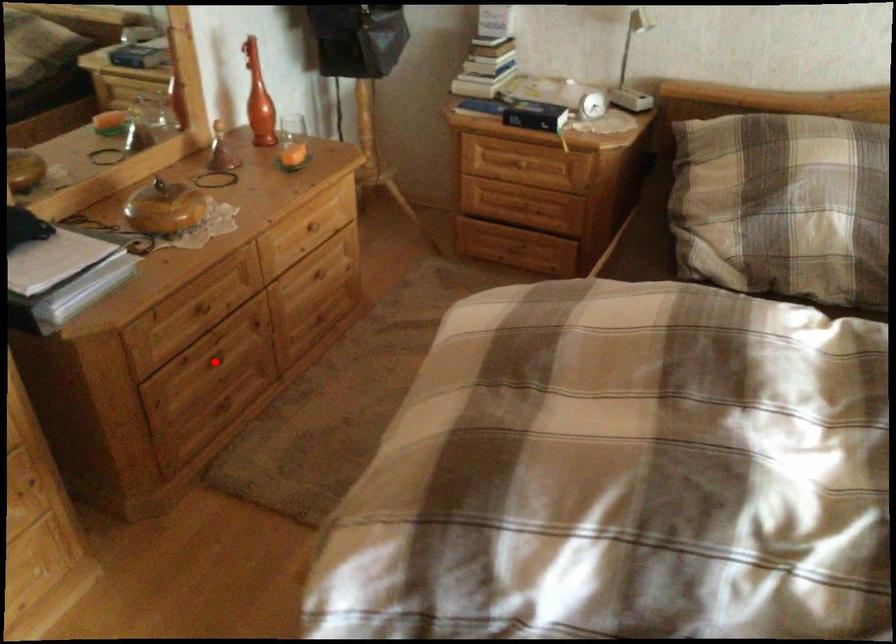
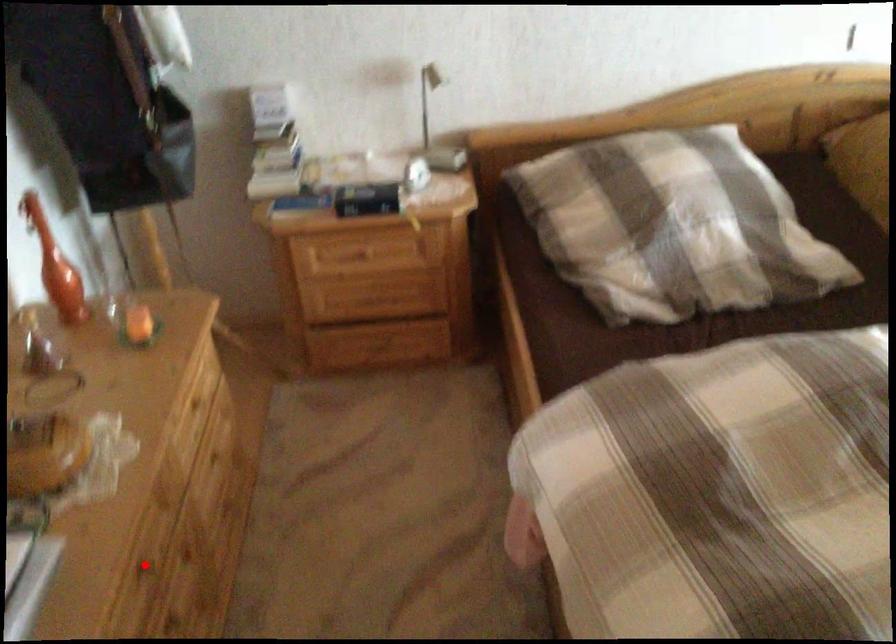
I am providing you with two images of the same scene from different viewpoints. A red point is marked on the first image and another point is marked on the second image. Is the marked point in image1 the same physical position as the marked point in image2?

No